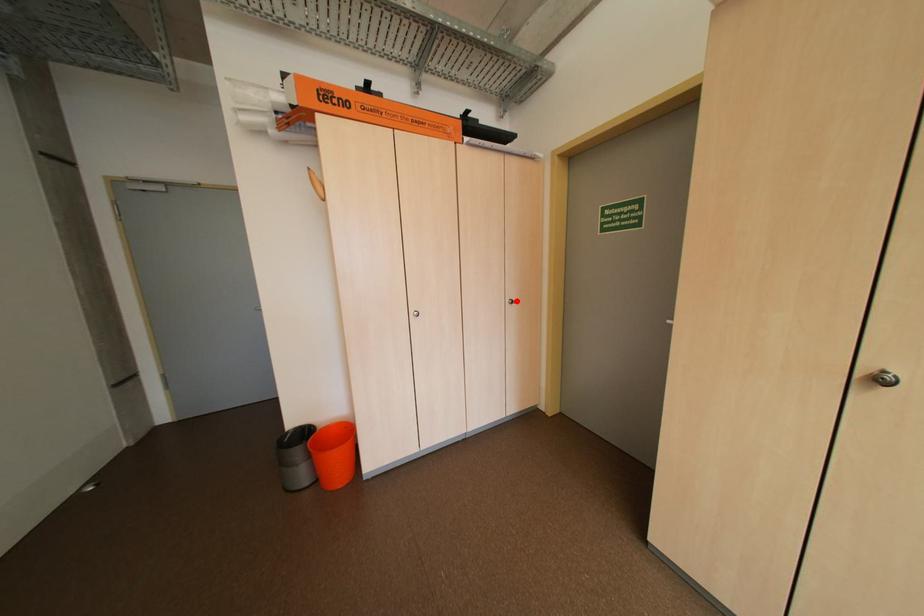
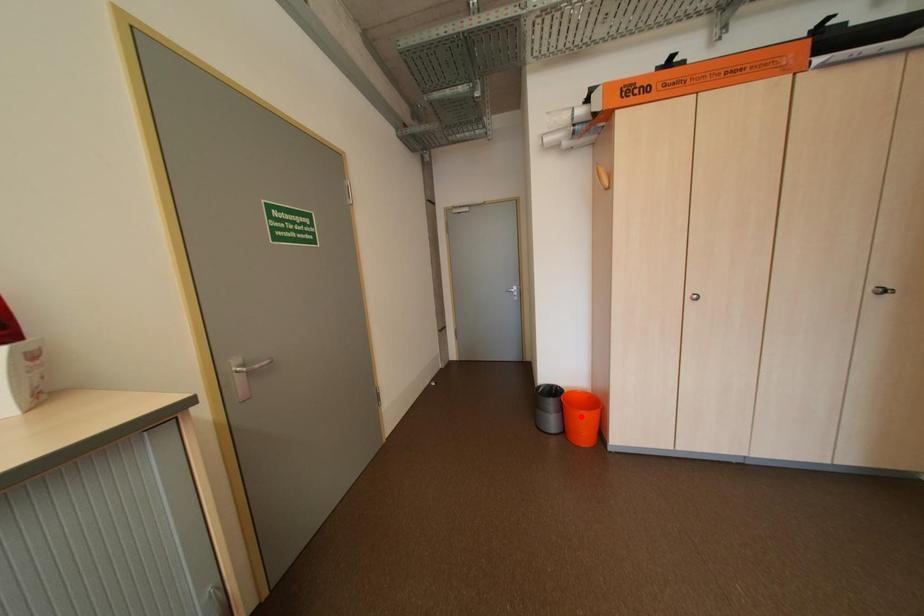
I am providing you with two images of the same scene from different viewpoints. A red point is marked on the first image and another point is marked on the second image. Are the points marked in image1 and image2 representing the same 3D position?

No